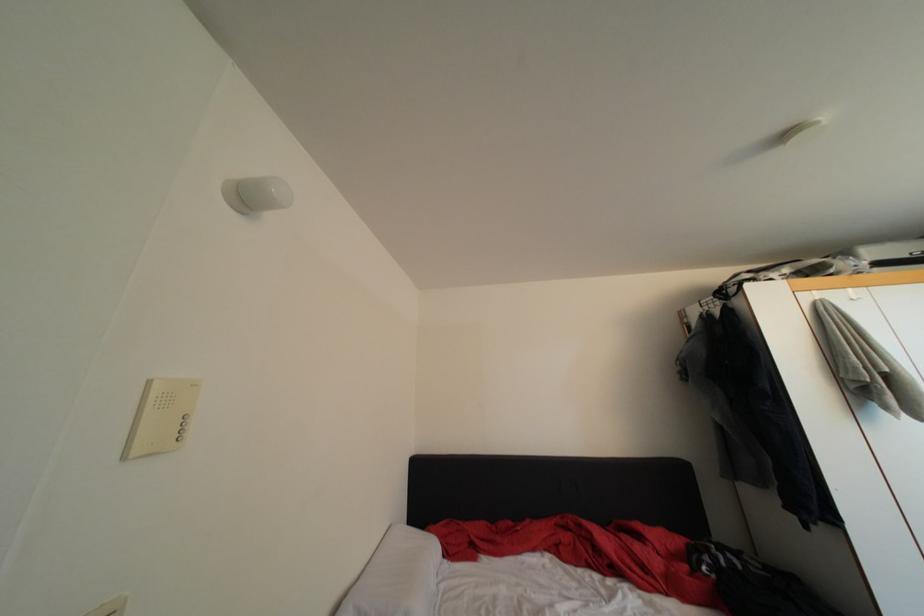
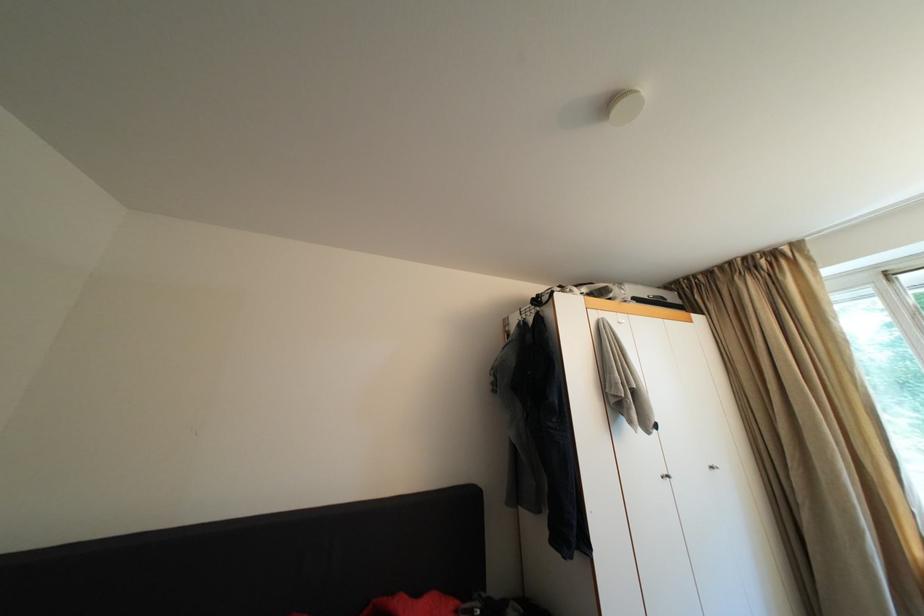
Question: The camera is either moving clockwise (left) or counter-clockwise (right) around the object. The first image is from the beginning of the video and the second image is from the end. Is the camera moving left or right when shooting the video?

Choices:
 (A) Left
 (B) Right

Answer: (A)